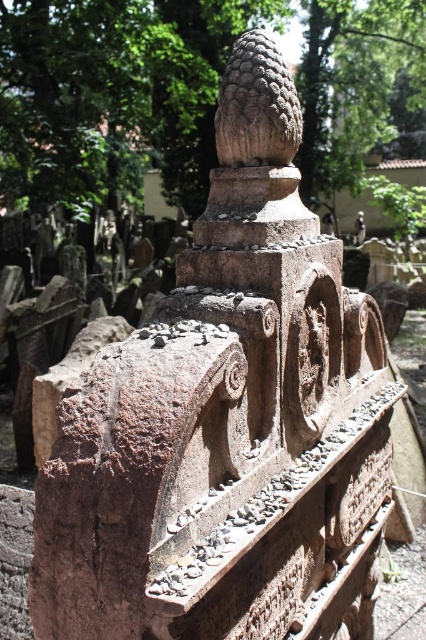
Question: Is brown stone cone at center thinner than rough stone cone at upper center?

Choices:
 (A) no
 (B) yes

Answer: (A)

Question: Can you confirm if brown stone cone at center is bigger than rough stone cone at upper center?

Choices:
 (A) yes
 (B) no

Answer: (A)

Question: Which point appears farthest from the camera in this image?

Choices:
 (A) (256, 92)
 (B) (155, 42)

Answer: (B)

Question: Does brown stone cone at center lie in front of rough stone cone at upper center?

Choices:
 (A) yes
 (B) no

Answer: (B)

Question: Which object is farther from the camera taking this photo?

Choices:
 (A) brown stone cone at center
 (B) rough stone cone at upper center

Answer: (A)

Question: Which point is closer to the camera?

Choices:
 (A) rough stone cone at upper center
 (B) brown stone cone at center

Answer: (A)